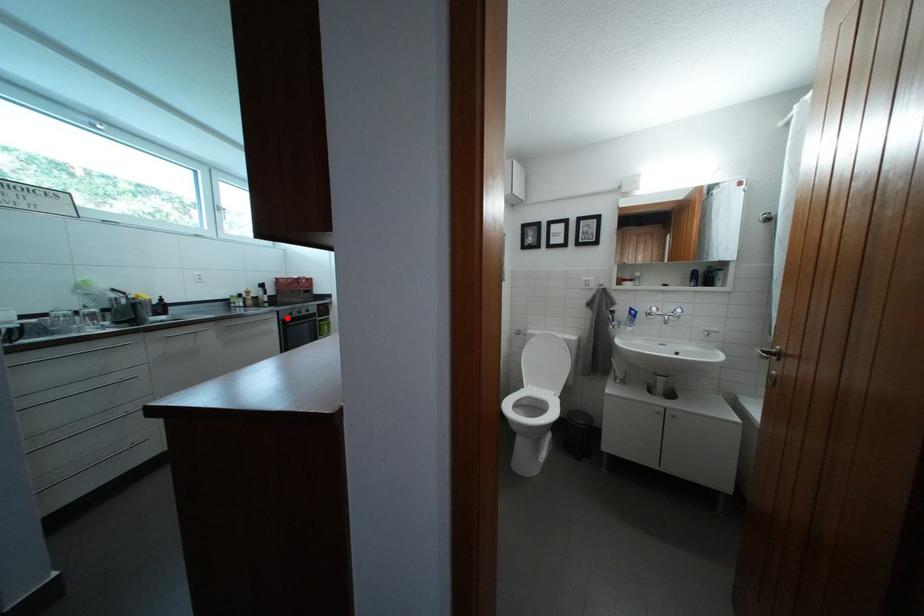
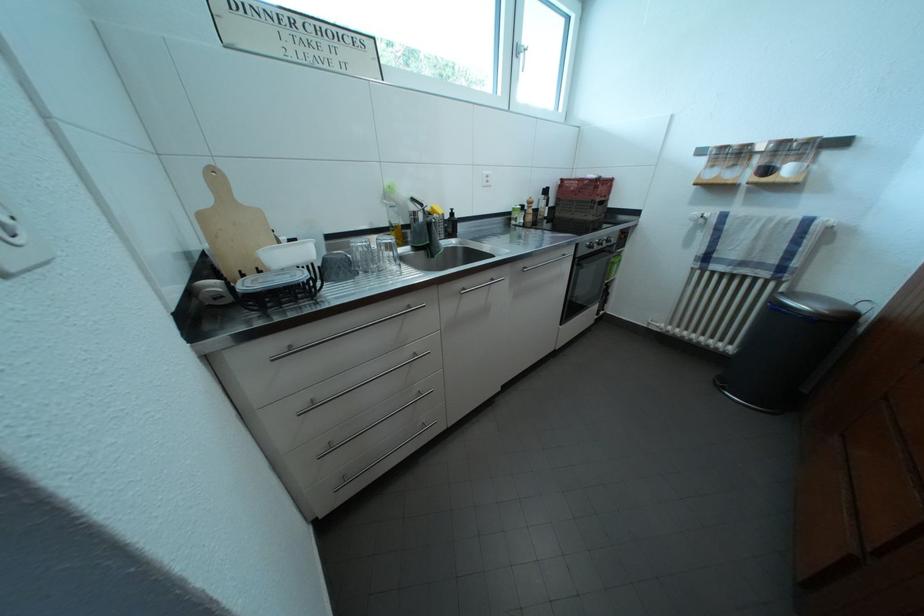
The point at the highlighted location is marked in the first image. Where is the corresponding point in the second image?

(587, 251)